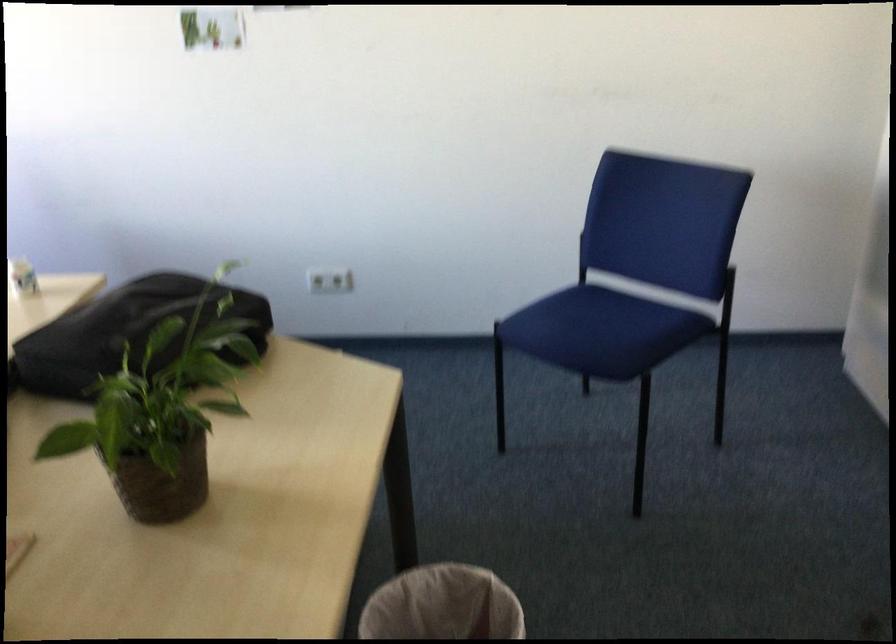
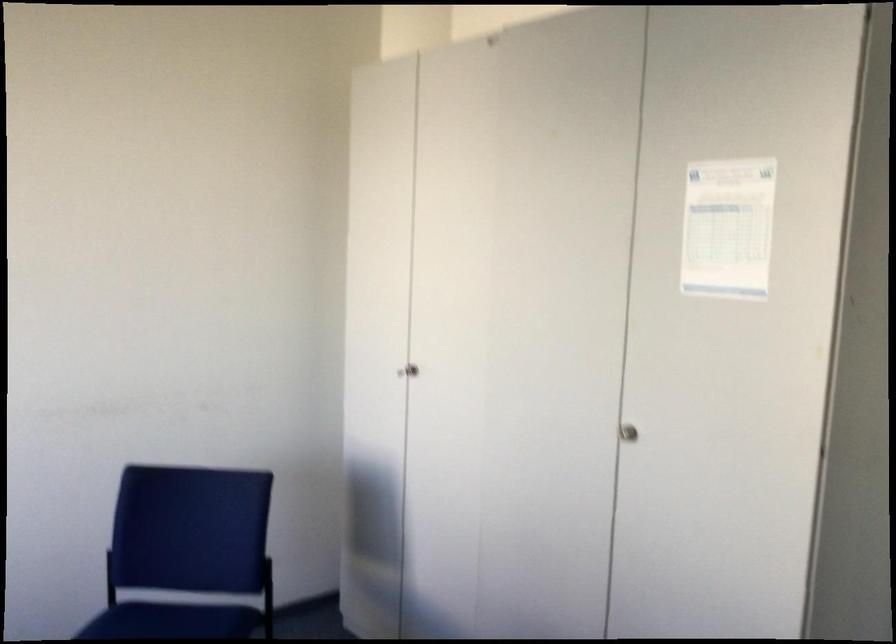
The first image is from the beginning of the video and the second image is from the end. How did the camera likely rotate when shooting the video?

The rotation direction of the camera is right-up.